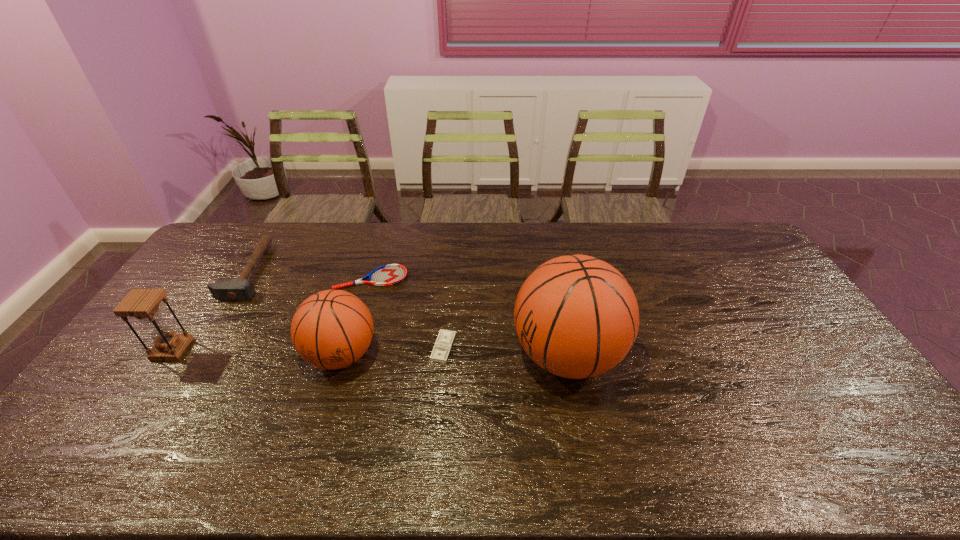
The width and height of the screenshot is (960, 540). Identify the location of free spot between the tallest object and the left basketball. (454, 355).

This screenshot has width=960, height=540. In order to click on object that is the third closest to the hourglass in this screenshot , I will do `click(390, 274)`.

Locate an element on the screen. The image size is (960, 540). the second closest object to the third shortest object is located at coordinates (390, 274).

Find the location of a particular element. Image resolution: width=960 pixels, height=540 pixels. free space that satisfies the following two spatial constraints: 1. on the back side of the shorter basketball; 2. on the striking surface of the third shortest object is located at coordinates (366, 272).

Locate an element on the screen. The height and width of the screenshot is (540, 960). free spot that satisfies the following two spatial constraints: 1. on the back side of the money; 2. on the striking surface of the fourth tallest object is located at coordinates (449, 272).

Identify the location of blank area in the image that satisfies the following two spatial constraints: 1. on the back side of the rightmost object; 2. on the striking surface of the third shortest object. Image resolution: width=960 pixels, height=540 pixels. (551, 272).

Identify the location of vacant area that satisfies the following two spatial constraints: 1. on the back side of the money; 2. on the striking surface of the hammer. This screenshot has width=960, height=540. (449, 272).

The width and height of the screenshot is (960, 540). What are the coordinates of `free spot that satisfies the following two spatial constraints: 1. on the back side of the shorter basketball; 2. on the striking surface of the third shortest object` in the screenshot? It's located at [x=366, y=272].

I want to click on blank area in the image that satisfies the following two spatial constraints: 1. on the striking surface of the hammer; 2. on the back side of the tennis racket, so click(245, 279).

I want to click on free location that satisfies the following two spatial constraints: 1. on the back side of the hourglass; 2. on the left side of the tennis racket, so click(x=220, y=279).